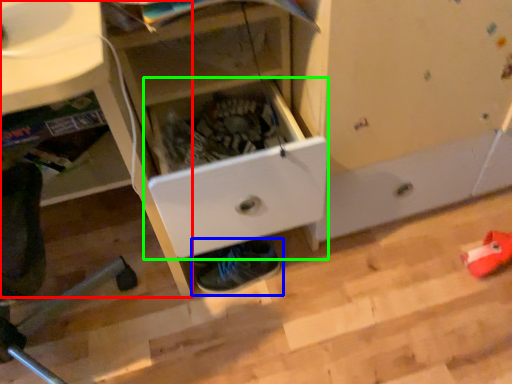
Question: Which object is the closest to the computer desk (highlighted by a red box)? Choose among these: footwear (highlighted by a blue box) or drawer (highlighted by a green box).

Choices:
 (A) footwear
 (B) drawer

Answer: (B)